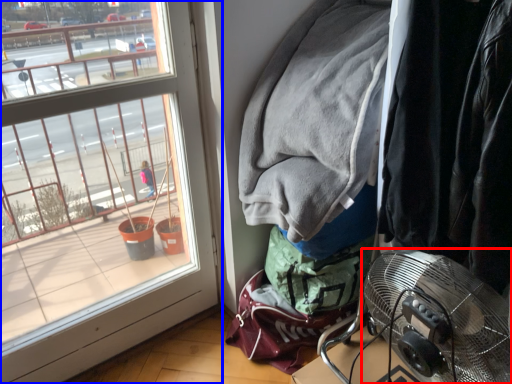
Question: Among these objects, which one is nearest to the camera, mechanical fan (highlighted by a red box) or window (highlighted by a blue box)?

Choices:
 (A) mechanical fan
 (B) window

Answer: (A)